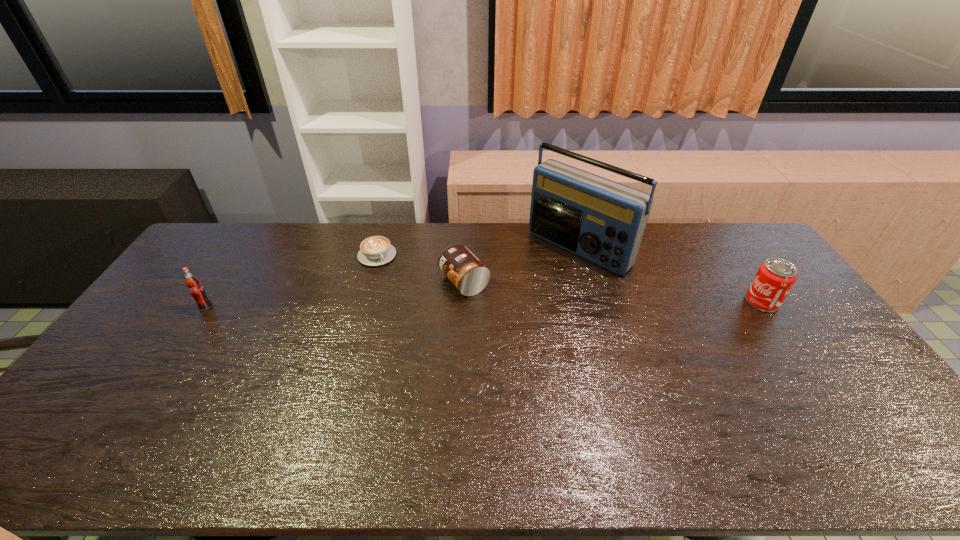
Identify the location of vacant space located on the back of the rightmost object. This screenshot has width=960, height=540. (710, 227).

Where is `free location located on the front panel of the radio receiver`? The width and height of the screenshot is (960, 540). free location located on the front panel of the radio receiver is located at coordinates (514, 302).

The image size is (960, 540). Find the location of `vacant space located 0.140m on the front panel of the radio receiver`. vacant space located 0.140m on the front panel of the radio receiver is located at coordinates (527, 291).

Image resolution: width=960 pixels, height=540 pixels. I want to click on vacant area located on the front panel of the radio receiver, so click(x=510, y=306).

Find the location of a particular element. vacant space located 0.080m on the side of the shortest object with the handle is located at coordinates (393, 279).

You are a GUI agent. You are given a task and a screenshot of the screen. Output one action in this format:
    pyautogui.click(x=<x>, y=<y>)
    Task: Click on the vacant space located 0.290m on the side of the shortest object with the handle
    This screenshot has height=540, width=960.
    Given the screenshot: What is the action you would take?
    pyautogui.click(x=420, y=318)

What are the coordinates of `vacant region located on the side of the shortest object with the handle` in the screenshot? It's located at (416, 312).

Where is `free space located on the front label of the second shortest object`? This screenshot has height=540, width=960. free space located on the front label of the second shortest object is located at coordinates (340, 334).

This screenshot has height=540, width=960. I want to click on vacant space located on the front label of the second shortest object, so click(x=347, y=331).

This screenshot has width=960, height=540. Identify the location of vacant space positioned on the front label of the second shortest object. pos(396,310).